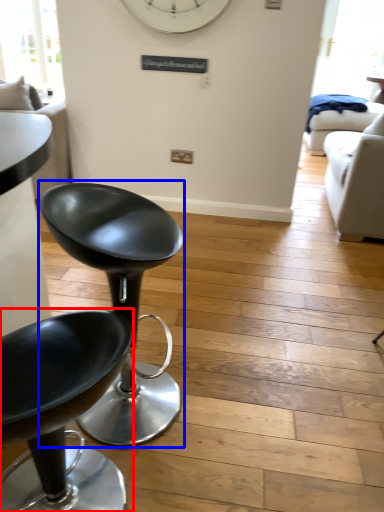
Question: Which object appears closest to the camera in this image, chair (highlighted by a red box) or chair (highlighted by a blue box)?

Choices:
 (A) chair
 (B) chair

Answer: (A)